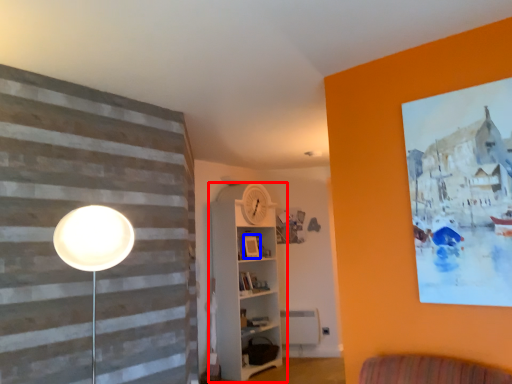
Question: Among these objects, which one is nearest to the camera, shelf (highlighted by a red box) or picture frame (highlighted by a blue box)?

Choices:
 (A) shelf
 (B) picture frame

Answer: (A)